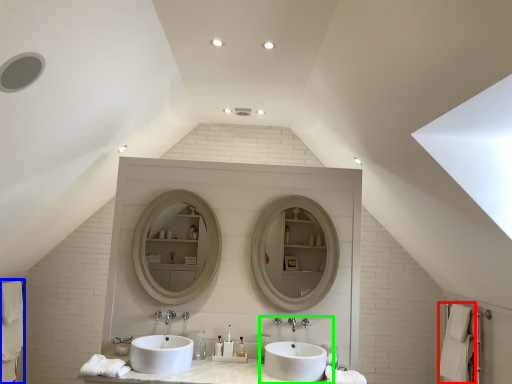
Question: Which object is positioned closest to bath towel (highlighted by a red box)? Select from bath towel (highlighted by a blue box) and sink (highlighted by a green box).

Choices:
 (A) bath towel
 (B) sink

Answer: (B)